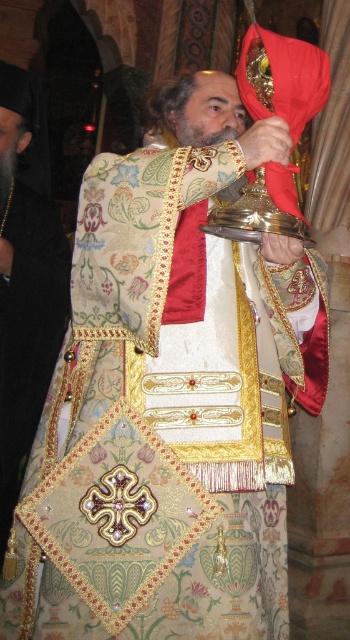
Question: Does gold embroidered vestment at center come behind grayish-brown beard at center?

Choices:
 (A) yes
 (B) no

Answer: (B)

Question: Considering the relative positions of gold embroidered vestment at center and grayish-brown beard at center in the image provided, where is gold embroidered vestment at center located with respect to grayish-brown beard at center?

Choices:
 (A) below
 (B) above

Answer: (A)

Question: Which object is farther from the camera taking this photo?

Choices:
 (A) grayish-brown beard at center
 (B) gold embroidered vestment at center

Answer: (A)

Question: Which object appears farthest from the camera in this image?

Choices:
 (A) gold embroidered vestment at center
 (B) grayish-brown beard at center

Answer: (B)

Question: Does gold embroidered vestment at center have a larger size compared to grayish-brown beard at center?

Choices:
 (A) yes
 (B) no

Answer: (A)